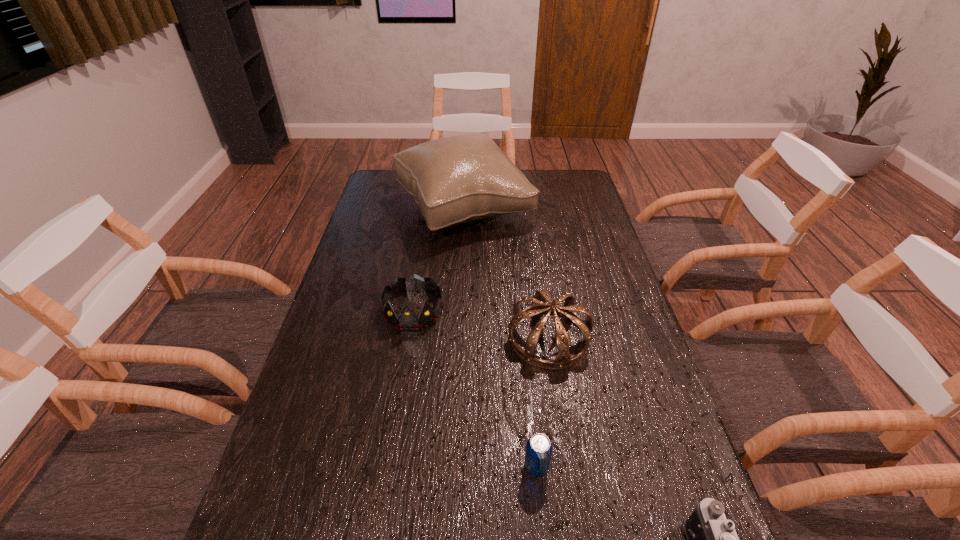
Identify the location of cushion. (463, 178).

Identify the location of the tallest object. (463, 178).

Where is `the second tallest object`? the second tallest object is located at coordinates click(x=563, y=360).

The height and width of the screenshot is (540, 960). I want to click on the taller tiara, so click(563, 360).

Where is `the left tiara`? This screenshot has height=540, width=960. the left tiara is located at coordinates (407, 320).

The image size is (960, 540). Identify the location of the shortest object. (539, 448).

I want to click on the second nearest object, so click(x=539, y=448).

This screenshot has height=540, width=960. In order to click on free space located on the left of the cushion in this screenshot , I will do `click(372, 209)`.

Where is `vacant space located on the back of the fourth shortest object`? vacant space located on the back of the fourth shortest object is located at coordinates (538, 265).

At what (x,y) coordinates should I click in order to perform the action: click on free space located 0.310m at the front of the shorter tiara with jewels. Please return your answer as a coordinate pair (x, y). This screenshot has height=540, width=960. Looking at the image, I should click on pos(393,438).